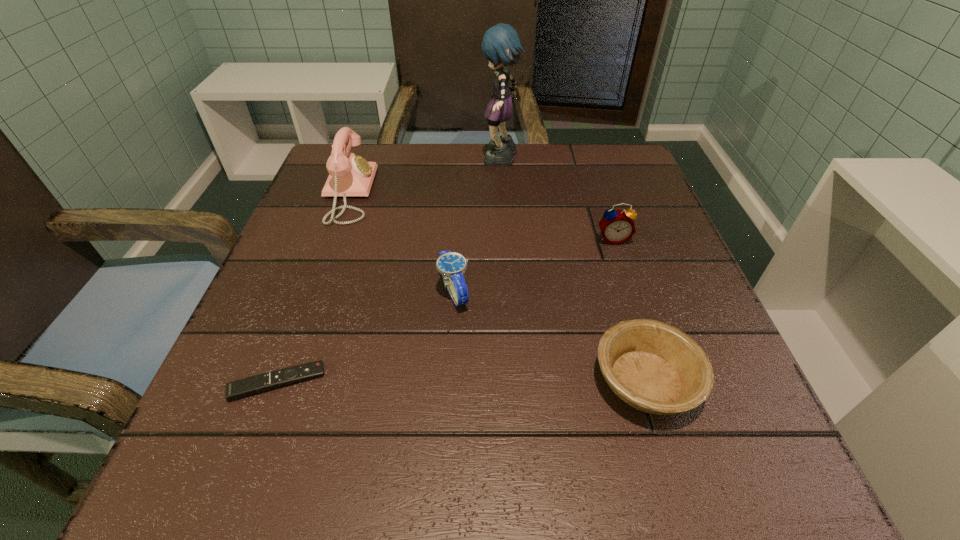
Point out which object is positioned as the fifth nearest to the third shortest object. Please provide its 2D coordinates. Your answer should be formatted as a tuple, i.e. [(x, y)], where the tuple contains the x and y coordinates of a point satisfying the conditions above.

[(501, 45)]

Where is `object that is the closest to the fourth nearest object`? The width and height of the screenshot is (960, 540). object that is the closest to the fourth nearest object is located at coordinates (656, 368).

This screenshot has height=540, width=960. Find the location of `vacant area that satisfies the following two spatial constraints: 1. on the front-facing side of the tallest object; 2. on the back side of the fifth tallest object`. vacant area that satisfies the following two spatial constraints: 1. on the front-facing side of the tallest object; 2. on the back side of the fifth tallest object is located at coordinates (515, 381).

Locate an element on the screen. This screenshot has height=540, width=960. vacant space that satisfies the following two spatial constraints: 1. on the back side of the fourth object from right to left; 2. on the dial of the telephone is located at coordinates (459, 193).

Find the location of `vacant space that satisfies the following two spatial constraints: 1. on the back side of the third shortest object; 2. on the dial of the fifth shortest object`. vacant space that satisfies the following two spatial constraints: 1. on the back side of the third shortest object; 2. on the dial of the fifth shortest object is located at coordinates (459, 193).

Find the location of a particular element. The width and height of the screenshot is (960, 540). free space in the image that satisfies the following two spatial constraints: 1. on the dial of the telephone; 2. on the right side of the bowl is located at coordinates (279, 381).

This screenshot has width=960, height=540. I want to click on free point that satisfies the following two spatial constraints: 1. on the back side of the fourth farthest object; 2. on the dial of the telephone, so click(459, 193).